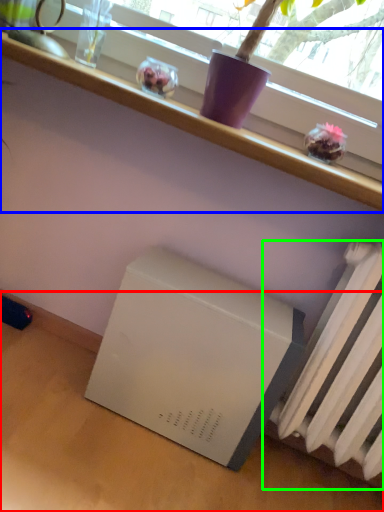
Question: Which object is the farthest from table (highlighted by a red box)? Choose among these: furniture (highlighted by a blue box) or radiator (highlighted by a green box).

Choices:
 (A) furniture
 (B) radiator

Answer: (A)